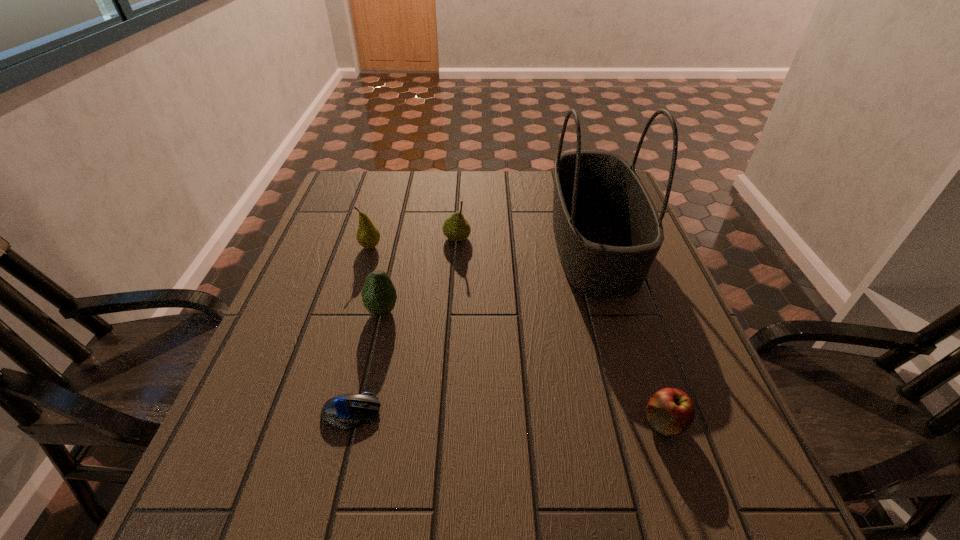
Locate an element on the screen. The image size is (960, 540). free point between the left pear and the shortest object is located at coordinates (361, 329).

Locate an element on the screen. unoccupied position between the right pear and the apple is located at coordinates (561, 330).

Identify the location of vacant space that is in between the computer mouse and the apple. The height and width of the screenshot is (540, 960). (508, 417).

This screenshot has width=960, height=540. I want to click on object that ranks as the closest to the right pear, so pos(368,236).

Find the location of a particular element. object that is the second closest to the basket is located at coordinates (670, 411).

The width and height of the screenshot is (960, 540). Find the location of `free space that satisfies the following two spatial constraints: 1. on the front side of the apple; 2. on the right side of the fourth object from left to right`. free space that satisfies the following two spatial constraints: 1. on the front side of the apple; 2. on the right side of the fourth object from left to right is located at coordinates (445, 423).

I want to click on vacant area in the image that satisfies the following two spatial constraints: 1. on the button side of the computer mouse; 2. on the right side of the apple, so click(x=348, y=423).